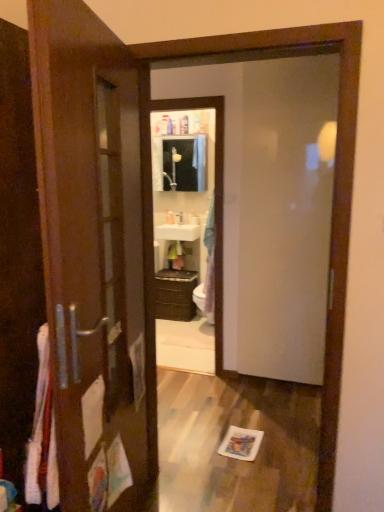
Question: In terms of height, does white glossy soap dispenser at center look taller or shorter compared to transparent glass door at center?

Choices:
 (A) short
 (B) tall

Answer: (A)

Question: From the image's perspective, is white glossy soap dispenser at center above or below transparent glass door at center?

Choices:
 (A) above
 (B) below

Answer: (A)

Question: Which object is the farthest from the brown matte cabinet at center?

Choices:
 (A) matte white medicine cabinet at center
 (B) white glossy soap dispenser at center
 (C) transparent glass door at center
 (D) white glossy sink at center

Answer: (C)

Question: Which object is the closest to the matte white medicine cabinet at center?

Choices:
 (A) white glossy soap dispenser at center
 (B) brown matte cabinet at center
 (C) white glossy sink at center
 (D) transparent glass door at center

Answer: (C)